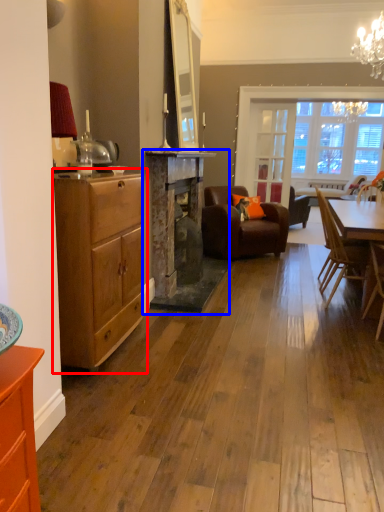
Question: Which of the following is the closest to the observer, chest of drawers (highlighted by a red box) or fireplace (highlighted by a blue box)?

Choices:
 (A) chest of drawers
 (B) fireplace

Answer: (A)